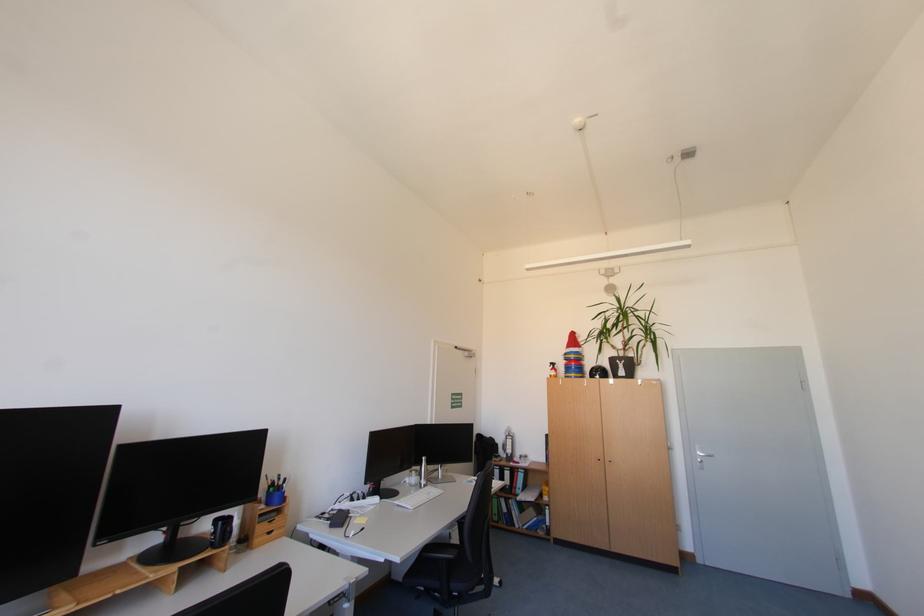
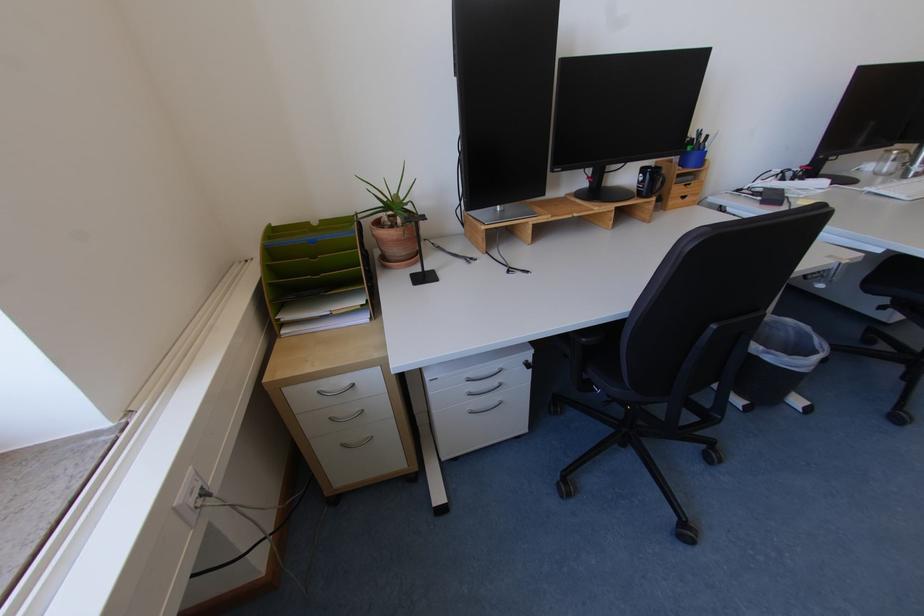
Find the pixel in the second image that matches (x=224, y=523) in the first image.

(650, 171)